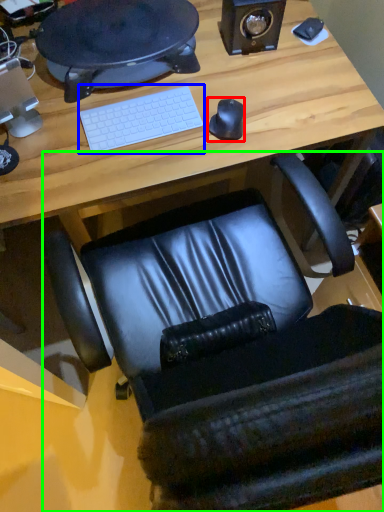
Question: Which object is the closest to the mouse (highlighted by a red box)? Choose among these: computer keyboard (highlighted by a blue box) or chair (highlighted by a green box).

Choices:
 (A) computer keyboard
 (B) chair

Answer: (A)